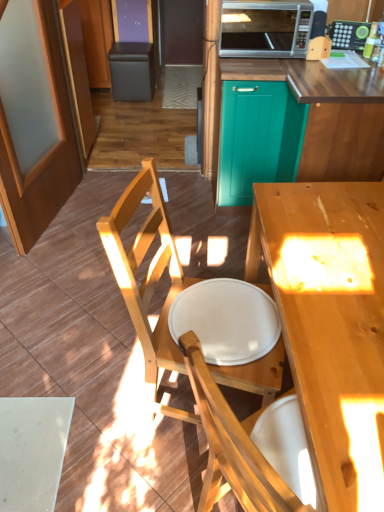
You are a GUI agent. You are given a task and a screenshot of the screen. Output one action in this format:
    pyautogui.click(x=<x>, y=<y>)
    Task: Click on the vacant region above teal wood cabinet at upper center (from a real-world perspective)
    The width and height of the screenshot is (384, 512).
    Given the screenshot: What is the action you would take?
    pyautogui.click(x=325, y=61)